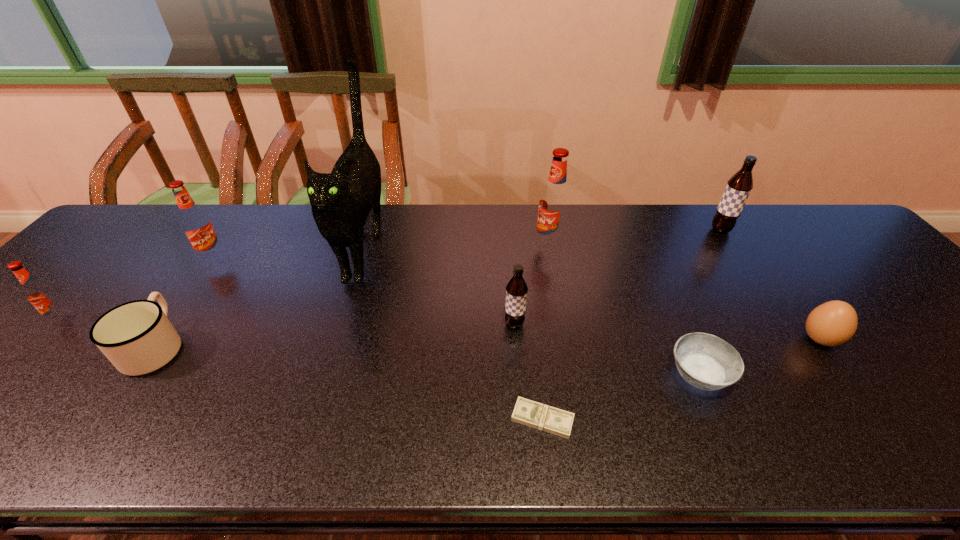
The height and width of the screenshot is (540, 960). What are the coordinates of `cat` in the screenshot? It's located at (341, 201).

The width and height of the screenshot is (960, 540). Find the location of `the tallest object`. the tallest object is located at coordinates (341, 201).

The image size is (960, 540). I want to click on the biggest red root beer, so click(x=554, y=202).

Identify the location of the rightmost red root beer. (554, 202).

Where is `the second biggest red root beer`? The image size is (960, 540). the second biggest red root beer is located at coordinates (195, 223).

Locate an element on the screen. the second red root beer from right to left is located at coordinates [x=195, y=223].

This screenshot has height=540, width=960. Identify the location of the farther brown root beer. (739, 186).

This screenshot has width=960, height=540. I want to click on the bigger brown root beer, so click(739, 186).

Identify the location of the leftmost red root beer. This screenshot has width=960, height=540. (42, 296).

The image size is (960, 540). In order to click on the nearest red root beer in this screenshot , I will do click(42, 296).